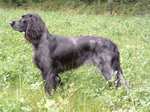
Identify the location of left front leg. (52, 81).